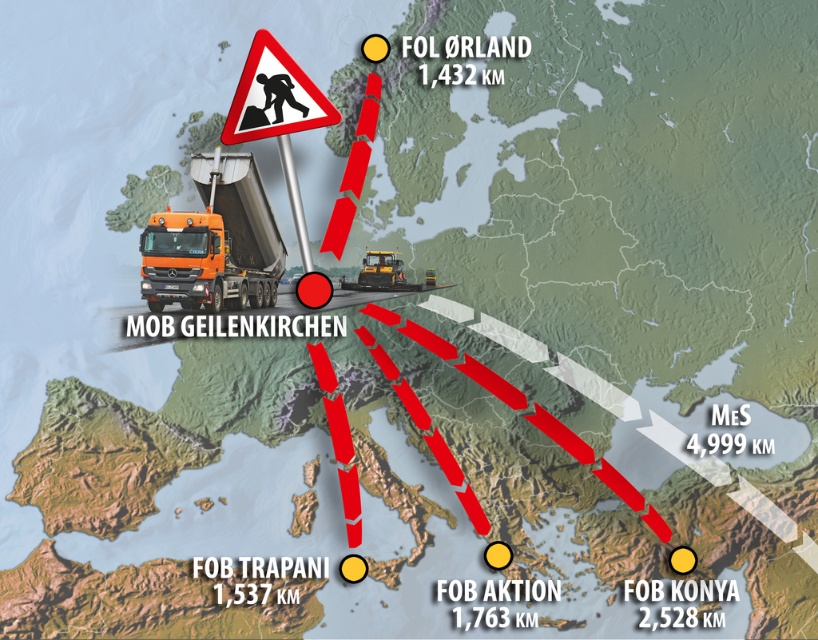
Can you confirm if orange matte truck at center is smaller than red plastic triangle at upper center?

No, orange matte truck at center is not smaller than red plastic triangle at upper center.

Between orange matte truck at center and red plastic triangle at upper center, which one is positioned lower?

orange matte truck at center is lower down.

Is point (207, 268) less distant than point (255, 115)?

No, it is not.

I want to click on orange matte truck at center, so click(x=214, y=243).

In the scene shown: Which is above, red plastic triangle at upper center or red plastic warning sign at upper center?

Positioned higher is red plastic warning sign at upper center.

Is point (266, 106) positioned after point (240, 116)?

No, (266, 106) is closer to viewer.

What do you see at coordinates (277, 115) in the screenshot? The height and width of the screenshot is (640, 818). I see `red plastic triangle at upper center` at bounding box center [277, 115].

This screenshot has width=818, height=640. In order to click on red plastic triangle at upper center in this screenshot , I will do `click(277, 115)`.

Can you confirm if orange matte truck at center is taller than red plastic warning sign at upper center?

Indeed, orange matte truck at center has a greater height compared to red plastic warning sign at upper center.

What do you see at coordinates (214, 243) in the screenshot? I see `orange matte truck at center` at bounding box center [214, 243].

Is point (203, 198) positioned in front of point (331, 109)?

No, it is behind (331, 109).

Identify the location of orange matte truck at center. The height and width of the screenshot is (640, 818). tap(214, 243).